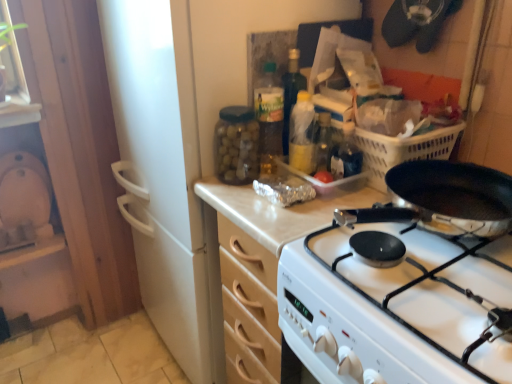
The width and height of the screenshot is (512, 384). Identify the location of free spot in front of clear plastic container at center. (303, 216).